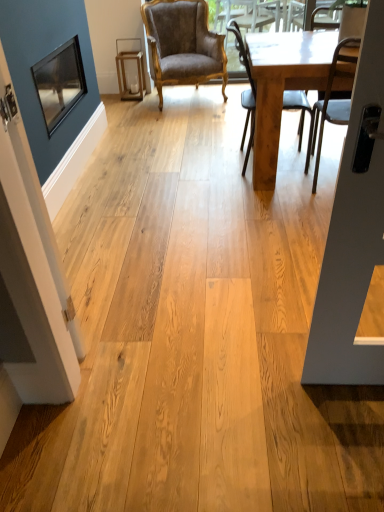
At what (x,y) coordinates should I click in order to perform the action: click on free space in front of velvet brown armchair at center, arranged as the third chair when viewed from the front. Please return your answer as a coordinate pair (x, y). The width and height of the screenshot is (384, 512). Looking at the image, I should click on (192, 119).